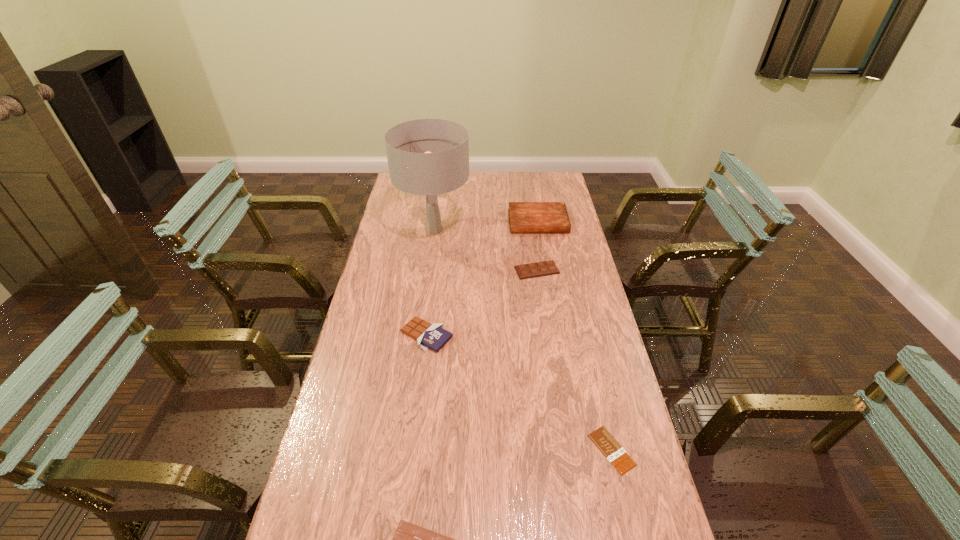
Where is `free space located 0.090m on the right of the fourth farthest object`? The height and width of the screenshot is (540, 960). free space located 0.090m on the right of the fourth farthest object is located at coordinates (481, 335).

You are a GUI agent. You are given a task and a screenshot of the screen. Output one action in this format:
    pyautogui.click(x=<x>, y=<y>)
    Task: Click on the vacant space located 0.160m on the back of the fourth nearest object
    This screenshot has width=960, height=540.
    Given the screenshot: What is the action you would take?
    pyautogui.click(x=532, y=237)

Find the location of `vacant space positioned 0.210m on the back of the shortest chocolate bar`. vacant space positioned 0.210m on the back of the shortest chocolate bar is located at coordinates (591, 364).

Locate an element on the screen. The image size is (960, 540). lampshade that is at the left edge is located at coordinates (429, 157).

Image resolution: width=960 pixels, height=540 pixels. Identify the location of chocolate bar present at the left edge. (433, 336).

Where is `Bible present at the right edge`? This screenshot has width=960, height=540. Bible present at the right edge is located at coordinates (524, 217).

The height and width of the screenshot is (540, 960). In the image, there is a desktop. Find the location of `vacant region at the far edge`. vacant region at the far edge is located at coordinates point(506,181).

Image resolution: width=960 pixels, height=540 pixels. Identify the location of vacant space at the left edge. tap(322, 512).

Where is `vacant space at the right edge of the desktop`? vacant space at the right edge of the desktop is located at coordinates (597, 408).

Where is `free space between the Bible and the fourth farthest object`? free space between the Bible and the fourth farthest object is located at coordinates (482, 279).